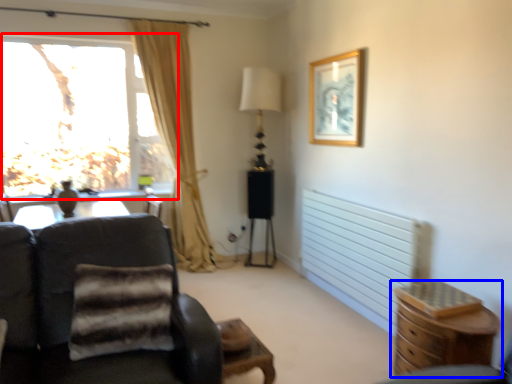
Question: Among these objects, which one is farthest to the camera, window (highlighted by a red box) or chest of drawers (highlighted by a blue box)?

Choices:
 (A) window
 (B) chest of drawers

Answer: (A)